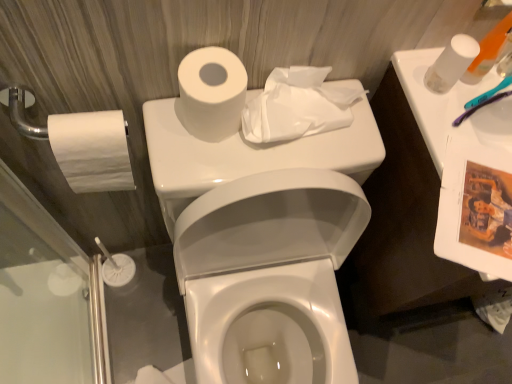
Question: Is white glossy toilet at center touching white plastic toothbrush at upper right, positioned as the first toiletry in left-to-right order?

Choices:
 (A) no
 (B) yes

Answer: (A)

Question: Is white plastic toothbrush at upper right, positioned as the first toiletry in left-to-right order, completely or partially inside white glossy toilet at center?

Choices:
 (A) yes
 (B) no

Answer: (B)

Question: Does white glossy toilet at center lie behind white plastic toothbrush at upper right, positioned as the first toiletry in left-to-right order?

Choices:
 (A) no
 (B) yes

Answer: (A)

Question: Is white glossy toilet at center wider than white plastic toothbrush at upper right, the 2th toiletry from the right?

Choices:
 (A) yes
 (B) no

Answer: (A)

Question: Is white glossy toilet at center smaller than white plastic toothbrush at upper right, positioned as the first toiletry in left-to-right order?

Choices:
 (A) no
 (B) yes

Answer: (A)

Question: Is white glossy toilet at center located outside white plastic toothbrush at upper right, positioned as the first toiletry in left-to-right order?

Choices:
 (A) no
 (B) yes

Answer: (B)

Question: Is there a large distance between white matte toilet paper at upper center, acting as the second toilet paper starting from the left, and white matte toilet paper at left, the 1th toilet paper when ordered from left to right?

Choices:
 (A) no
 (B) yes

Answer: (A)

Question: Can you confirm if white matte toilet paper at upper center, which appears as the third toilet paper when viewed from the right, is positioned to the left of white matte toilet paper at left, the fourth toilet paper positioned from the right?

Choices:
 (A) yes
 (B) no

Answer: (B)

Question: Is white matte toilet paper at left, the fourth toilet paper positioned from the right, inside white matte toilet paper at upper center, which appears as the third toilet paper when viewed from the right?

Choices:
 (A) yes
 (B) no

Answer: (B)

Question: Is white matte toilet paper at left, the 1th toilet paper when ordered from left to right, at the back of white matte toilet paper at upper center, which appears as the third toilet paper when viewed from the right?

Choices:
 (A) no
 (B) yes

Answer: (A)

Question: Is white matte toilet paper at upper center, which appears as the third toilet paper when viewed from the right, positioned before white matte toilet paper at left, the 1th toilet paper when ordered from left to right?

Choices:
 (A) no
 (B) yes

Answer: (B)

Question: From the image's perspective, does white matte toilet paper at upper center, which appears as the third toilet paper when viewed from the right, appear lower than white matte toilet paper at left, the 1th toilet paper when ordered from left to right?

Choices:
 (A) no
 (B) yes

Answer: (A)

Question: Is white matte toilet paper at upper right, positioned as the first toilet paper in right-to-left order, positioned before white matte toilet paper at upper center, acting as the second toilet paper starting from the left?

Choices:
 (A) yes
 (B) no

Answer: (B)